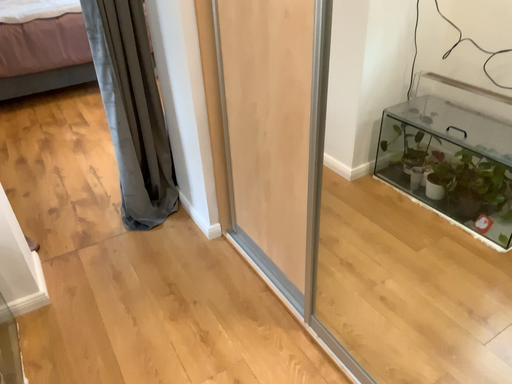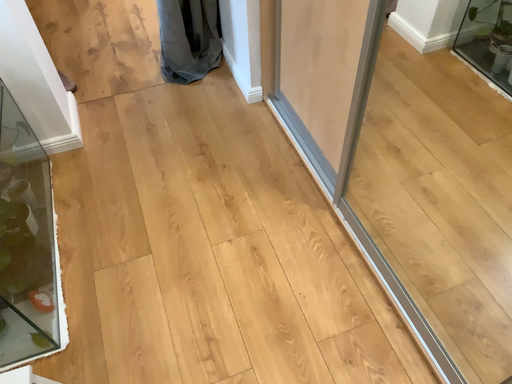
Question: Which way did the camera rotate in the video?

Choices:
 (A) rotated right
 (B) rotated left

Answer: (B)